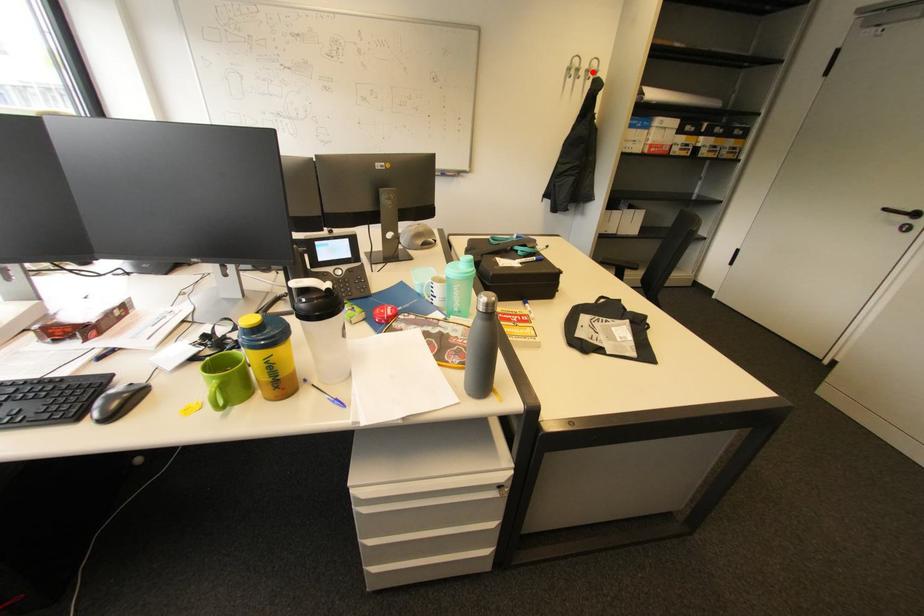
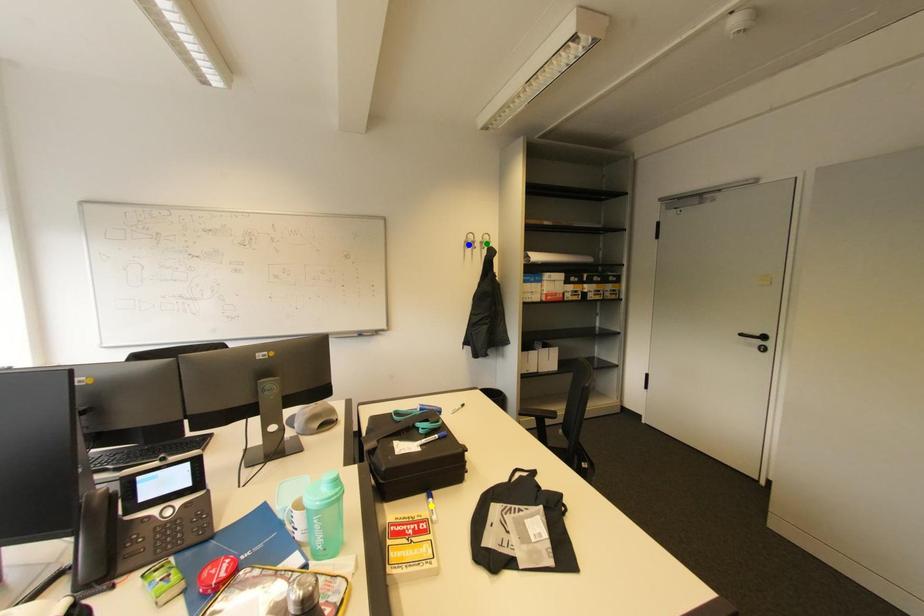
Question: I am providing you with two images of the same scene from different viewpoints. A red point is marked on the first image. You are given multiple points on the second image. Which point in image 2 represents the same 3d spot as the red point in image 1?

Choices:
 (A) yellow point
 (B) green point
 (C) blue point

Answer: (B)